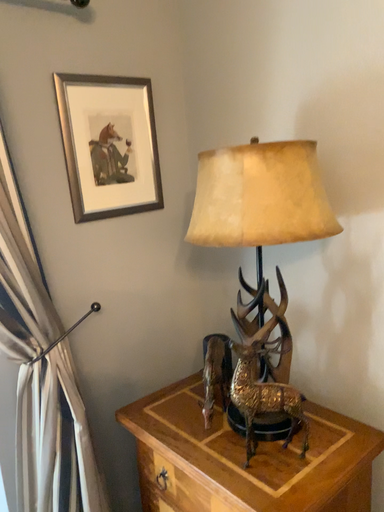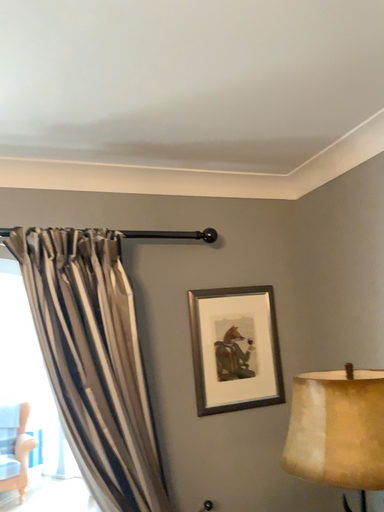
Question: How did the camera likely rotate when shooting the video?

Choices:
 (A) rotated left
 (B) rotated right

Answer: (A)